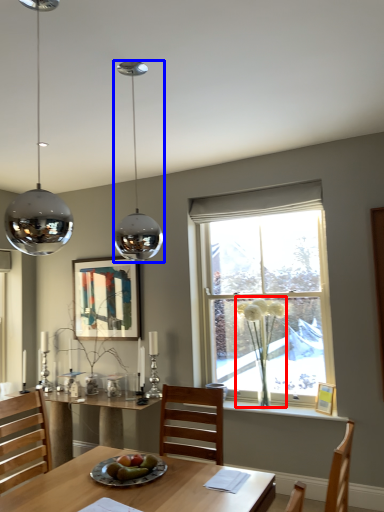
Question: Which object is further to the camera taking this photo, flower (highlighted by a red box) or lamp (highlighted by a blue box)?

Choices:
 (A) flower
 (B) lamp

Answer: (A)